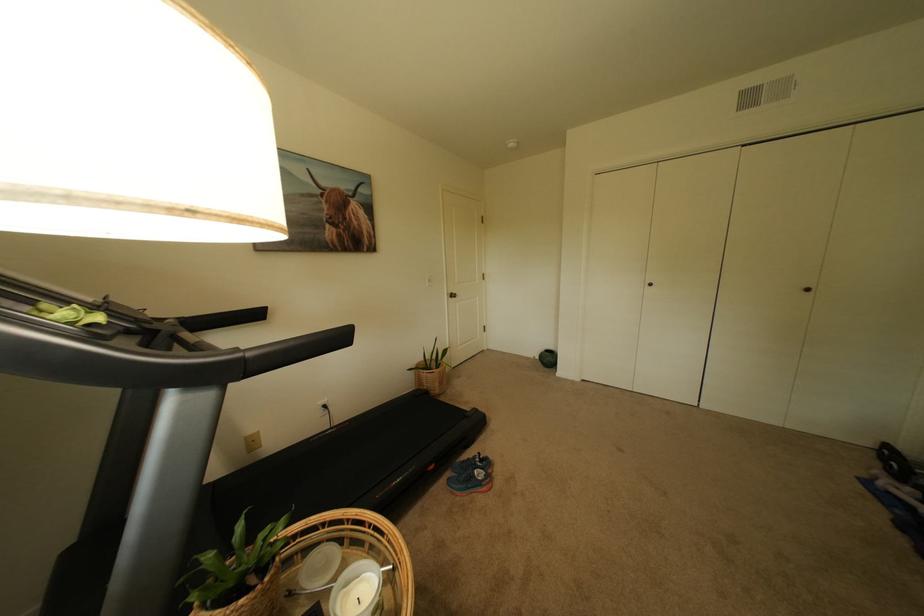
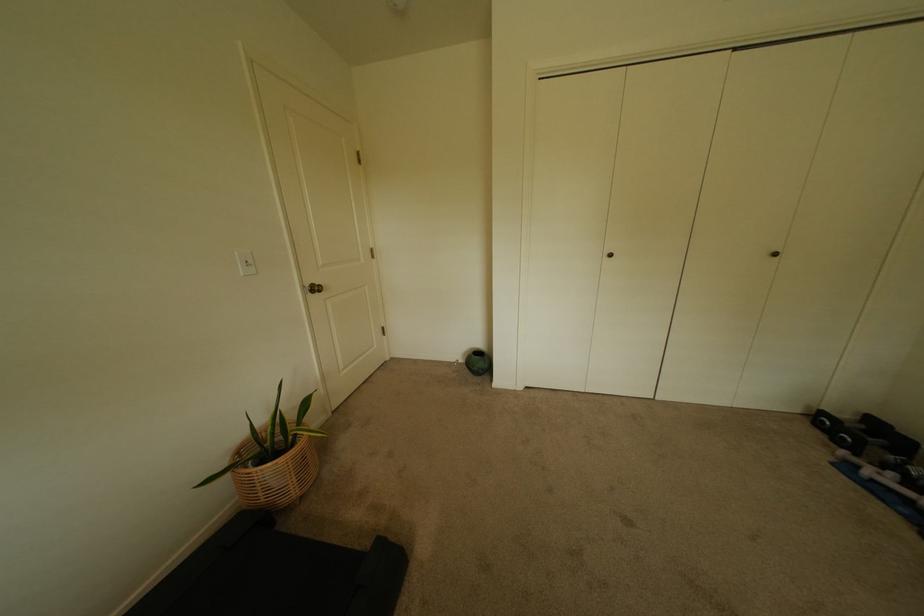
The point at [896,448] is marked in the first image. Where is the corresponding point in the second image?

(831, 415)